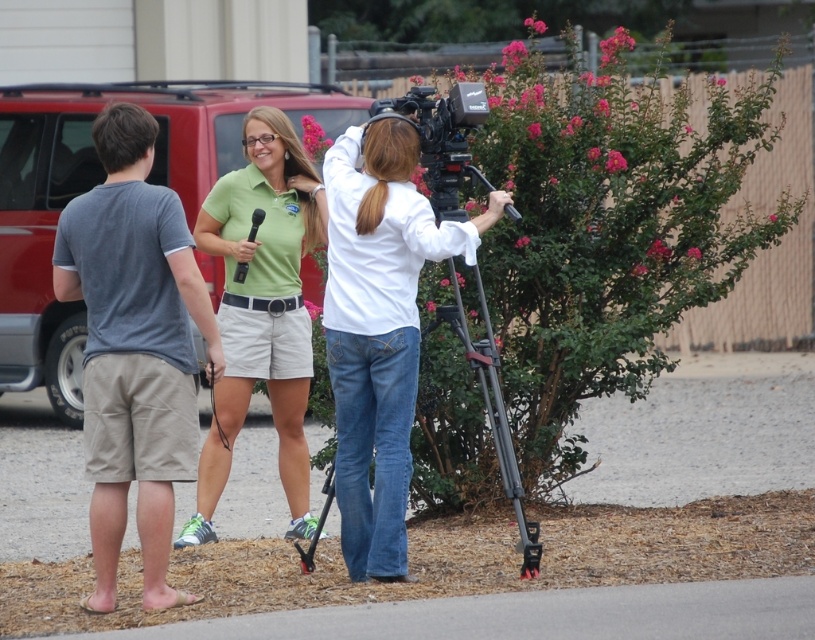
You are a photographer trying to capture a clear shot of the white cotton shirt at center and the green matte shorts at center. Which one is closer to the camera?

The white cotton shirt at center is closer to the camera because it is in front of the green matte shorts at center.

You are a fashion designer analyzing the scene. You need to determine which shorts are shorter between the gray cotton shorts at left and the green matte shorts at center. Which one is shorter?

The gray cotton shorts at left has a lesser height compared to green matte shorts at center, so the gray cotton shorts at left are shorter.